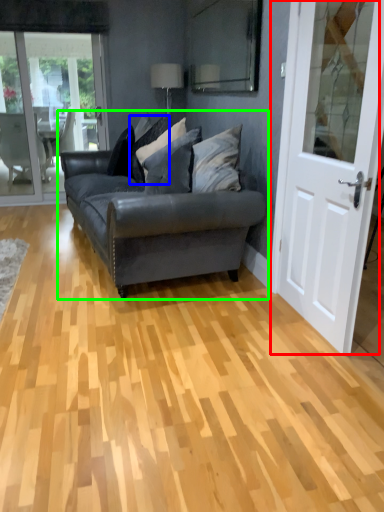
Question: Which object is positioned closest to door (highlighted by a red box)? Select from pillow (highlighted by a blue box) and studio couch (highlighted by a green box).

Choices:
 (A) pillow
 (B) studio couch

Answer: (B)